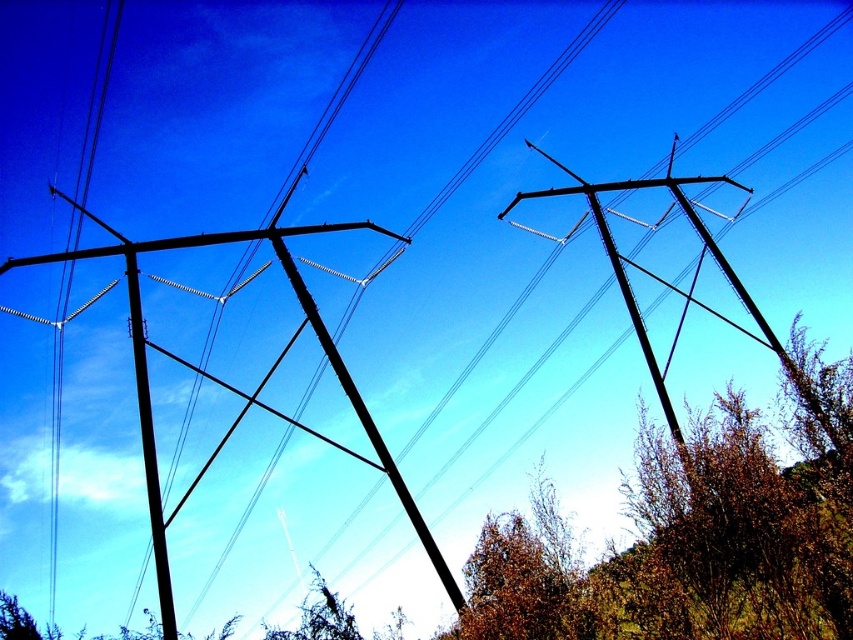
Question: Is black metallic telegraph pole at left to the right of smooth black telegraph pole at center from the viewer's perspective?

Choices:
 (A) no
 (B) yes

Answer: (A)

Question: Among these objects, which one is farthest from the camera?

Choices:
 (A) smooth black telegraph pole at center
 (B) black metallic telegraph pole at left
 (C) brown leafy tree at lower right

Answer: (B)

Question: Which of these objects is positioned farthest from the black metallic telegraph pole at left?

Choices:
 (A) brown leafy tree at lower right
 (B) smooth black telegraph pole at center

Answer: (B)

Question: Which of the following is the farthest from the observer?

Choices:
 (A) smooth black telegraph pole at center
 (B) brown leafy tree at lower right

Answer: (A)

Question: Is black metallic telegraph pole at left wider than smooth black telegraph pole at center?

Choices:
 (A) yes
 (B) no

Answer: (A)

Question: Is brown leafy tree at lower right thinner than black metallic telegraph pole at left?

Choices:
 (A) yes
 (B) no

Answer: (B)